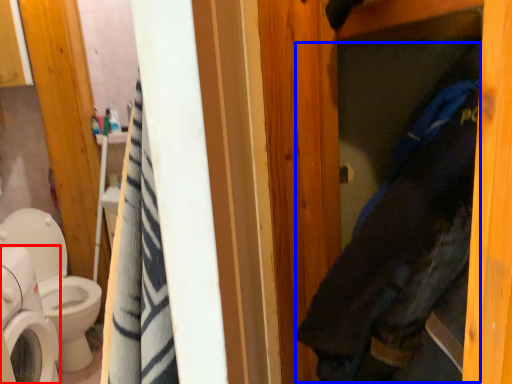
Question: Which of the following is the closest to the observer, washing machine (highlighted by a red box) or clothing (highlighted by a blue box)?

Choices:
 (A) washing machine
 (B) clothing

Answer: (B)